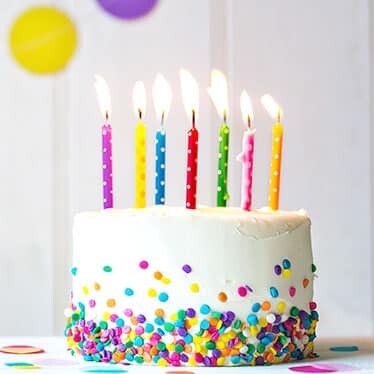
At what (x,y) coordinates should I click in order to perform the action: click on candle wicks. Please return your answer as a coordinate pair (x, y). This screenshot has width=374, height=374. Looking at the image, I should click on (107, 120), (140, 119), (162, 124), (194, 125), (225, 124), (248, 127), (277, 120).